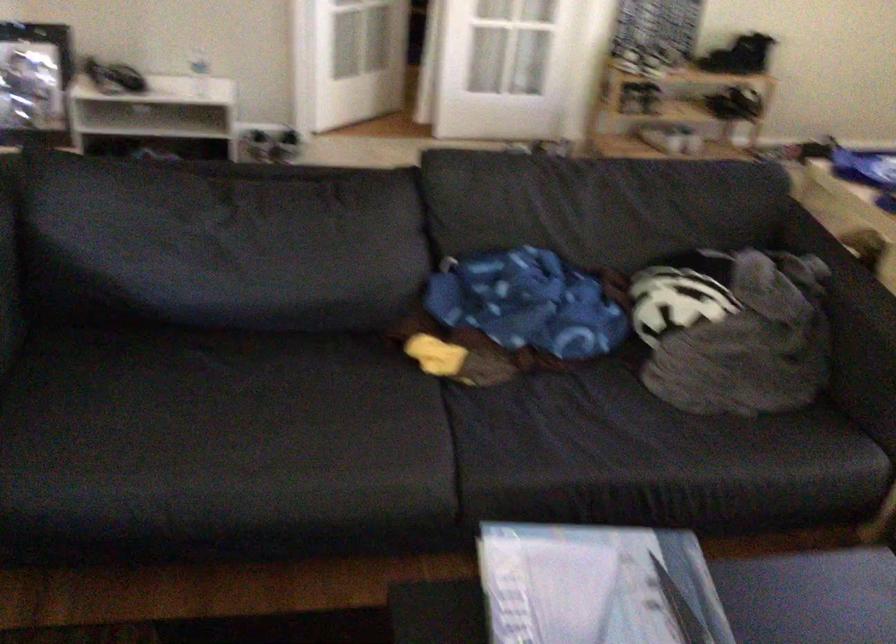
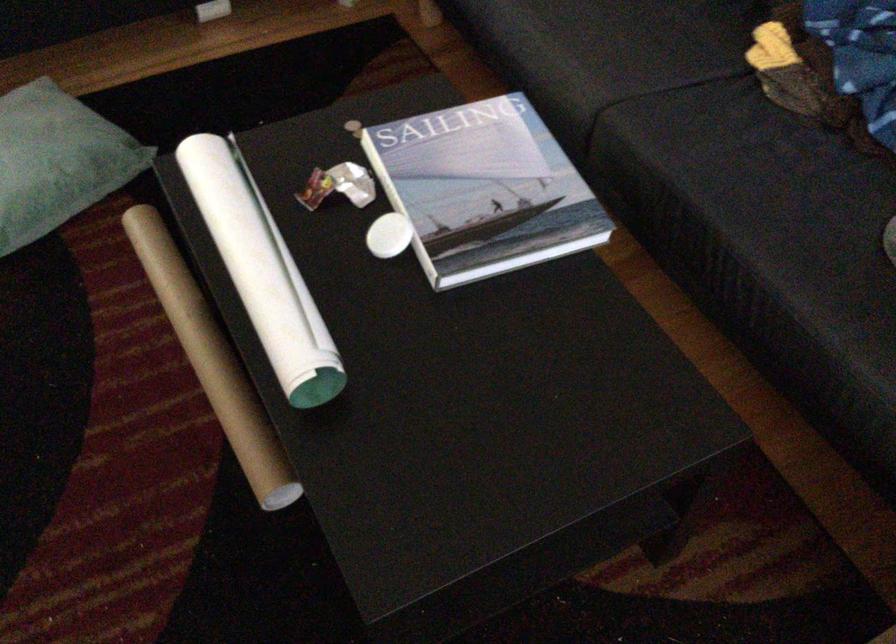
Find the pixel in the second image that matches pixel 616 433 in the first image.

(778, 199)